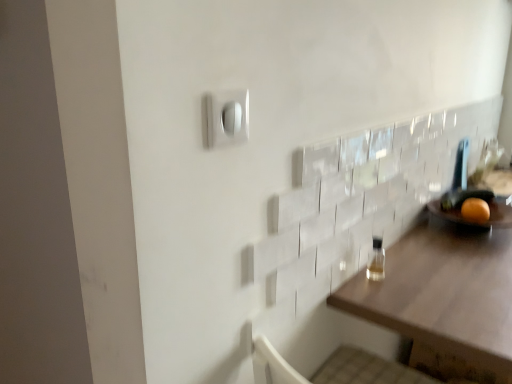
Question: Can you confirm if orange matte at right is wider than brown wooden table at right?

Choices:
 (A) yes
 (B) no

Answer: (B)

Question: Does orange matte at right contain brown wooden table at right?

Choices:
 (A) yes
 (B) no

Answer: (B)

Question: Does orange matte at right turn towards brown wooden table at right?

Choices:
 (A) yes
 (B) no

Answer: (B)

Question: Can you confirm if orange matte at right is bigger than brown wooden table at right?

Choices:
 (A) yes
 (B) no

Answer: (B)

Question: Considering the relative positions of orange matte at right and brown wooden table at right in the image provided, is orange matte at right behind brown wooden table at right?

Choices:
 (A) no
 (B) yes

Answer: (B)

Question: Is orange matte at right facing away from brown wooden table at right?

Choices:
 (A) no
 (B) yes

Answer: (A)

Question: Is orange matte at right bigger than white plastic light switch at upper center?

Choices:
 (A) yes
 (B) no

Answer: (A)

Question: Is orange matte at right positioned far away from white plastic light switch at upper center?

Choices:
 (A) yes
 (B) no

Answer: (A)

Question: Does orange matte at right lie in front of white plastic light switch at upper center?

Choices:
 (A) yes
 (B) no

Answer: (B)

Question: From the image's perspective, is orange matte at right located beneath white plastic light switch at upper center?

Choices:
 (A) yes
 (B) no

Answer: (A)

Question: Does orange matte at right have a lesser height compared to white plastic light switch at upper center?

Choices:
 (A) yes
 (B) no

Answer: (A)

Question: Is orange matte at right smaller than white plastic light switch at upper center?

Choices:
 (A) no
 (B) yes

Answer: (A)

Question: Is brown wooden table at right wider than clear glass bottle at right?

Choices:
 (A) yes
 (B) no

Answer: (A)